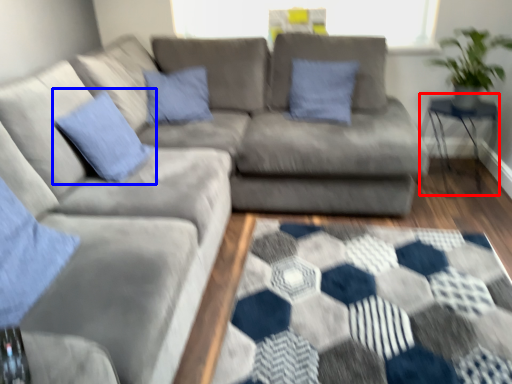
Question: Which object is closer to the camera taking this photo, table (highlighted by a red box) or pillow (highlighted by a blue box)?

Choices:
 (A) table
 (B) pillow

Answer: (B)